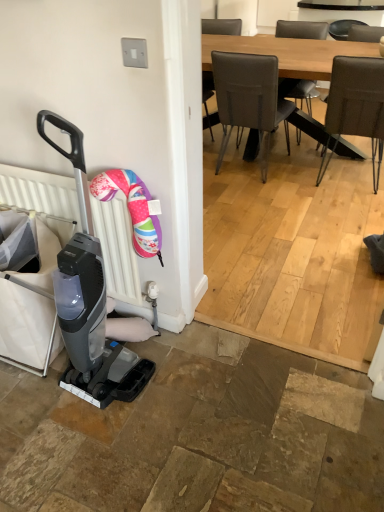
This screenshot has height=512, width=384. Describe the element at coordinates (356, 105) in the screenshot. I see `leather-like brown chair at upper right` at that location.

This screenshot has height=512, width=384. I want to click on leather-like brown chair at upper right, so click(356, 105).

Describe the element at coordinates (88, 297) in the screenshot. I see `matte black baby carriage at left` at that location.

Where is `white plastic radiator at left`? The height and width of the screenshot is (512, 384). white plastic radiator at left is located at coordinates (117, 249).

This screenshot has width=384, height=512. Describe the element at coordinates (288, 53) in the screenshot. I see `light brown wooden table at upper center` at that location.

I want to click on leather-like brown chair at upper right, so click(x=356, y=105).

Is point (285, 63) closer or farther from the camera than point (338, 122)?

Point (285, 63) is farther from the camera than point (338, 122).

Is there a large distance between light brown wooden table at upper center and leather-like brown chair at upper right?

No, light brown wooden table at upper center is not far away from leather-like brown chair at upper right.

Is leather-like brown chair at upper right a part of light brown wooden table at upper center?

Yes, leather-like brown chair at upper right can be found within light brown wooden table at upper center.

Image resolution: width=384 pixels, height=512 pixels. In the image, there is a white plastic radiator at left. What are the coordinates of `chair above it (from the image's perspective)` in the screenshot? It's located at (356, 105).

From the image's perspective, who appears lower, white plastic radiator at left or leather-like brown chair at upper right?

white plastic radiator at left.

From a real-world perspective, is white plastic radiator at left above or below leather-like brown chair at upper right?

In terms of real-world spatial position, white plastic radiator at left is below leather-like brown chair at upper right.

Does white plastic radiator at left have a lesser width compared to leather-like brown chair at upper right?

Yes, white plastic radiator at left is thinner than leather-like brown chair at upper right.

Considering the relative sizes of light brown wooden table at upper center and white plastic radiator at left in the image provided, is light brown wooden table at upper center bigger than white plastic radiator at left?

Indeed, light brown wooden table at upper center has a larger size compared to white plastic radiator at left.

From the image's perspective, is light brown wooden table at upper center located above white plastic radiator at left?

Yes, from the image's perspective, light brown wooden table at upper center is over white plastic radiator at left.

Considering the positions of objects light brown wooden table at upper center and white plastic radiator at left in the image provided, who is behind, light brown wooden table at upper center or white plastic radiator at left?

light brown wooden table at upper center is behind.

Is light brown wooden table at upper center touching white plastic radiator at left?

No, light brown wooden table at upper center is not with white plastic radiator at left.

How different are the orientations of white plastic radiator at left and light brown wooden table at upper center in degrees?

179 degrees.

Does white plastic radiator at left have a lesser width compared to light brown wooden table at upper center?

Yes.

Is white plastic radiator at left positioned far away from light brown wooden table at upper center?

white plastic radiator at left is positioned a significant distance from light brown wooden table at upper center.

From a real-world perspective, which is physically above, white plastic radiator at left or light brown wooden table at upper center?

white plastic radiator at left.

The height and width of the screenshot is (512, 384). What are the coordinates of `baby carriage below the leather-like brown chair at upper right (from the image's perspective)` in the screenshot? It's located at (88, 297).

Which object is thinner, matte black baby carriage at left or leather-like brown chair at upper right?

matte black baby carriage at left.

Which of these two, matte black baby carriage at left or leather-like brown chair at upper right, is smaller?

With smaller size is matte black baby carriage at left.

Does point (332, 79) appear closer or farther from the camera than point (115, 273)?

Point (332, 79).

I want to click on chair behind the white plastic radiator at left, so click(x=356, y=105).

Is leather-like brown chair at upper right positioned beyond the bounds of white plastic radiator at left?

Yes, leather-like brown chair at upper right is outside of white plastic radiator at left.

Can you confirm if leather-like brown chair at upper right is wider than white plastic radiator at left?

Yes, leather-like brown chair at upper right is wider than white plastic radiator at left.

How many degrees apart are the facing directions of matte black baby carriage at left and white plastic radiator at left?

There is a 2.18-degree angle between the facing directions of matte black baby carriage at left and white plastic radiator at left.

Considering the positions of objects matte black baby carriage at left and white plastic radiator at left in the image provided, who is in front, matte black baby carriage at left or white plastic radiator at left?

Positioned in front is matte black baby carriage at left.

From a real-world perspective, is matte black baby carriage at left above or below white plastic radiator at left?

matte black baby carriage at left is above white plastic radiator at left.

Does point (72, 284) come in front of point (25, 182)?

Yes.

In the image, there is a light brown wooden table at upper center. Identify the location of chair below it (from the image's perspective). (356, 105).

This screenshot has height=512, width=384. I want to click on chair above the white plastic radiator at left (from the image's perspective), so click(356, 105).

Based on their spatial positions, is light brown wooden table at upper center or leather-like brown chair at upper right further from white plastic radiator at left?

light brown wooden table at upper center lies further to white plastic radiator at left than the other object.

Considering their positions, is white plastic radiator at left positioned further to leather-like brown chair at upper right than matte black baby carriage at left?

Among the two, matte black baby carriage at left is located further to leather-like brown chair at upper right.

Based on their spatial positions, is white plastic radiator at left or light brown wooden table at upper center further from leather-like brown chair at upper right?

Based on the image, white plastic radiator at left appears to be further to leather-like brown chair at upper right.

From the image, which object appears to be nearer to matte black baby carriage at left, light brown wooden table at upper center or leather-like brown chair at upper right?

The object closer to matte black baby carriage at left is leather-like brown chair at upper right.

Considering their positions, is light brown wooden table at upper center positioned further to matte black baby carriage at left than white plastic radiator at left?

Based on the image, light brown wooden table at upper center appears to be further to matte black baby carriage at left.

Estimate the real-world distances between objects in this image. Which object is further from matte black baby carriage at left, white plastic radiator at left or leather-like brown chair at upper right?

The object further to matte black baby carriage at left is leather-like brown chair at upper right.

Estimate the real-world distances between objects in this image. Which object is further from light brown wooden table at upper center, matte black baby carriage at left or white plastic radiator at left?

matte black baby carriage at left.

When comparing their distances from matte black baby carriage at left, does leather-like brown chair at upper right or light brown wooden table at upper center seem closer?

Among the two, leather-like brown chair at upper right is located nearer to matte black baby carriage at left.

This screenshot has width=384, height=512. Identify the location of chair between matte black baby carriage at left and light brown wooden table at upper center from front to back. (356, 105).

Where is `kitchen & dining room table between white plastic radiator at left and leather-like brown chair at upper right from left to right`? Image resolution: width=384 pixels, height=512 pixels. kitchen & dining room table between white plastic radiator at left and leather-like brown chair at upper right from left to right is located at coordinates (288, 53).

You are a GUI agent. You are given a task and a screenshot of the screen. Output one action in this format:
    pyautogui.click(x=<x>, y=<y>)
    Task: Click on the baby carriage located between white plastic radiator at left and leather-like brown chair at upper right in the left-right direction
    Image resolution: width=384 pixels, height=512 pixels.
    Given the screenshot: What is the action you would take?
    pyautogui.click(x=88, y=297)

Where is `baby carriage situated between white plastic radiator at left and light brown wooden table at upper center from left to right`? baby carriage situated between white plastic radiator at left and light brown wooden table at upper center from left to right is located at coordinates (88, 297).